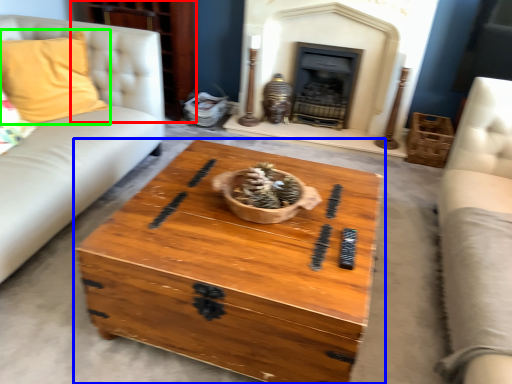
Question: Based on their relative distances, which object is farther from dresser (highlighted by a red box)? Choose from coffee table (highlighted by a blue box) and pillow (highlighted by a green box).

Choices:
 (A) coffee table
 (B) pillow

Answer: (A)